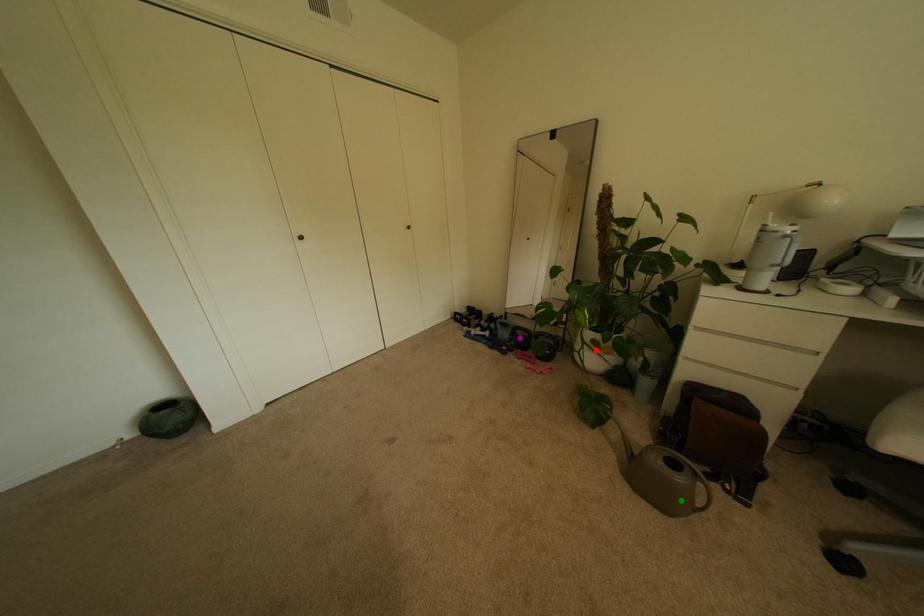
Order these from nearest to farthest:
purple point | red point | green point

green point, red point, purple point